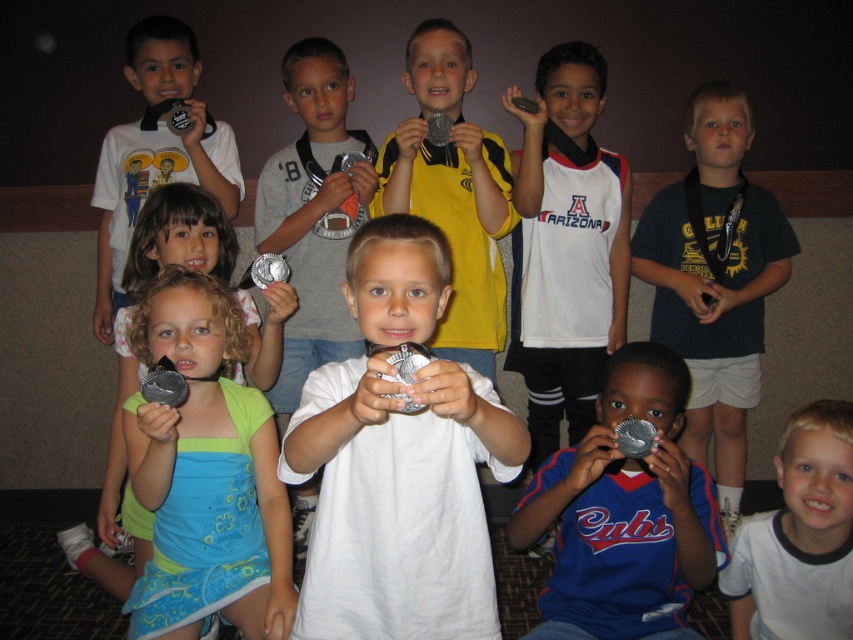
Does matte silver medal at lower left have a greater height compared to white cotton shirt at lower right?

Yes, matte silver medal at lower left is taller than white cotton shirt at lower right.

Is matte silver medal at lower left bigger than white cotton shirt at lower right?

Yes.

Is point (228, 557) closer to camera compared to point (833, 472)?

No, (228, 557) is further to viewer.

At what (x,y) coordinates should I click in order to perform the action: click on matte silver medal at lower left. Please return your answer as a coordinate pair (x, y). Looking at the image, I should click on (206, 474).

Can you confirm if dark blue t-shirt at center is taller than white cotton shirt at lower right?

Yes.

Can you confirm if dark blue t-shirt at center is thinner than white cotton shirt at lower right?

In fact, dark blue t-shirt at center might be wider than white cotton shirt at lower right.

This screenshot has width=853, height=640. I want to click on dark blue t-shirt at center, so (x=714, y=280).

Between point (163, 545) and point (630, 509), which one is positioned behind?

The point (163, 545) is behind.

The width and height of the screenshot is (853, 640). What are the coordinates of `matte silver medal at lower left` in the screenshot? It's located at (206, 474).